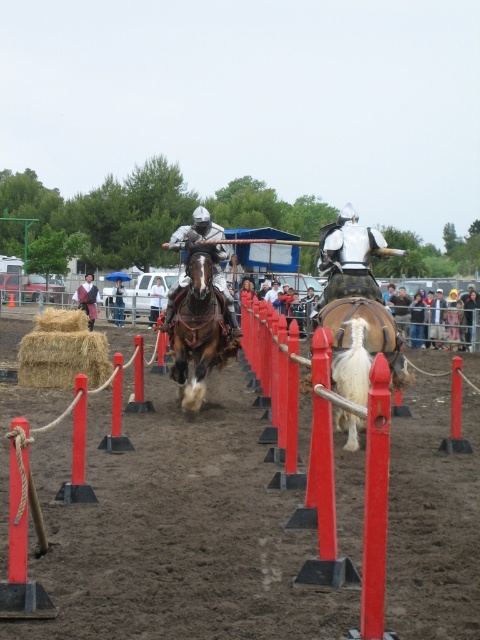
Can you confirm if leather jacket at left is wider than smooth leather helmet at center?

Correct, the width of leather jacket at left exceeds that of smooth leather helmet at center.

Between point (96, 298) and point (154, 304), which one is positioned behind?

The point (154, 304) is behind.

Is point (90, 316) in front of point (154, 298)?

That is True.

Image resolution: width=480 pixels, height=640 pixels. What are the coordinates of `leather jacket at left` in the screenshot? It's located at (87, 300).

Which is below, dirt field at center or white fuzzy horse at center?

dirt field at center is lower down.

Does dirt field at center have a larger size compared to white fuzzy horse at center?

Yes.

Is point (180, 544) positioned before point (344, 355)?

That is True.

What are the coordinates of `dirt field at center` in the screenshot? It's located at (177, 531).

Does brown leather horse at center appear on the right side of leather jacket at left?

Correct, you'll find brown leather horse at center to the right of leather jacket at left.

Is brown leather horse at center to the left of leather jacket at left from the viewer's perspective?

In fact, brown leather horse at center is to the right of leather jacket at left.

Which is behind, point (220, 317) or point (73, 298)?

Positioned behind is point (73, 298).

The image size is (480, 640). Find the location of `brown leather horse at center`. brown leather horse at center is located at coordinates (199, 330).